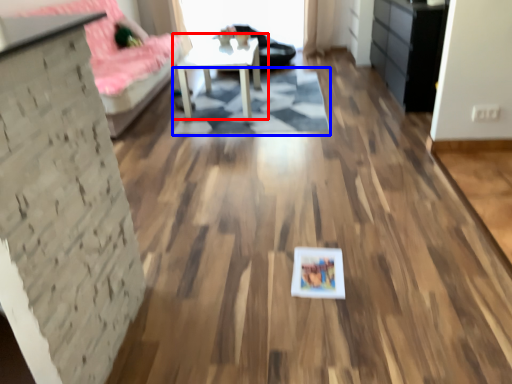
Question: Which of the following is the farthest to the observer, table (highlighted by a red box) or mat (highlighted by a blue box)?

Choices:
 (A) table
 (B) mat

Answer: (A)